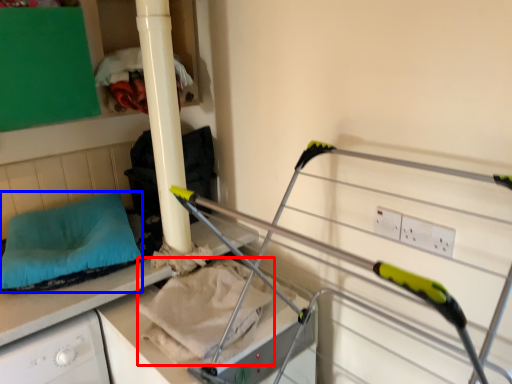
Question: Among these objects, which one is nearest to the camera, sheet (highlighted by a red box) or pillow (highlighted by a blue box)?

Choices:
 (A) sheet
 (B) pillow

Answer: (A)